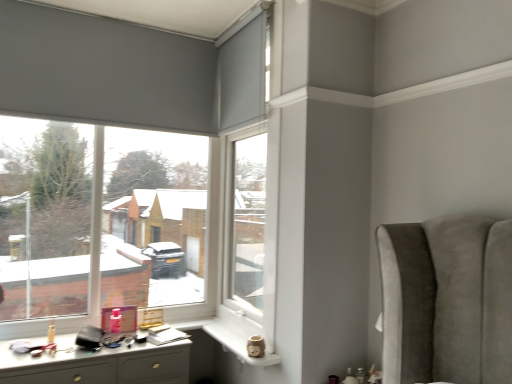
Question: Is white plastic window frame at center taller than white glossy desk at lower left?

Choices:
 (A) yes
 (B) no

Answer: (A)

Question: Does white plastic window frame at center appear on the right side of white glossy desk at lower left?

Choices:
 (A) yes
 (B) no

Answer: (A)

Question: Is white plastic window frame at center touching white glossy desk at lower left?

Choices:
 (A) yes
 (B) no

Answer: (B)

Question: Does white plastic window frame at center appear on the left side of white glossy desk at lower left?

Choices:
 (A) no
 (B) yes

Answer: (A)

Question: Can you confirm if white plastic window frame at center is smaller than white glossy desk at lower left?

Choices:
 (A) no
 (B) yes

Answer: (B)

Question: Does point (103, 34) appear closer or farther from the camera than point (236, 334)?

Choices:
 (A) closer
 (B) farther

Answer: (A)

Question: Is matte gray roller blind at left to the left or to the right of white ceramic mug at lower center in the image?

Choices:
 (A) right
 (B) left

Answer: (B)

Question: Is matte gray roller blind at left in front of or behind white ceramic mug at lower center in the image?

Choices:
 (A) behind
 (B) front

Answer: (A)

Question: From the image's perspective, relative to white ceramic mug at lower center, is matte gray roller blind at left above or below?

Choices:
 (A) above
 (B) below

Answer: (A)

Question: Does point (207, 332) appear closer or farther from the camera than point (178, 94)?

Choices:
 (A) farther
 (B) closer

Answer: (A)

Question: Which is correct: white ceramic mug at lower center is inside matte gray roller blind at left, or outside of it?

Choices:
 (A) outside
 (B) inside

Answer: (A)

Question: Relative to matte gray roller blind at left, is white ceramic mug at lower center in front or behind?

Choices:
 (A) behind
 (B) front

Answer: (B)

Question: From a real-world perspective, is white ceramic mug at lower center physically located above or below matte gray roller blind at left?

Choices:
 (A) above
 (B) below

Answer: (B)

Question: From a real-world perspective, is matte gray roller blind at left physically located above or below white plastic window frame at center?

Choices:
 (A) below
 (B) above

Answer: (B)

Question: Relative to white plastic window frame at center, is matte gray roller blind at left in front or behind?

Choices:
 (A) front
 (B) behind

Answer: (B)